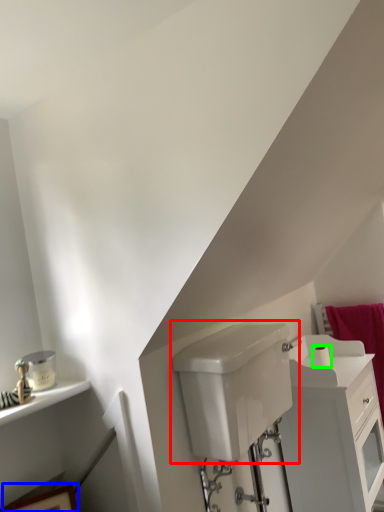
Question: Considering the real-world distances, which object is farthest from sink (highlighted by a red box)? picture frame (highlighted by a blue box) or toilet paper (highlighted by a green box)?

Choices:
 (A) picture frame
 (B) toilet paper

Answer: (A)